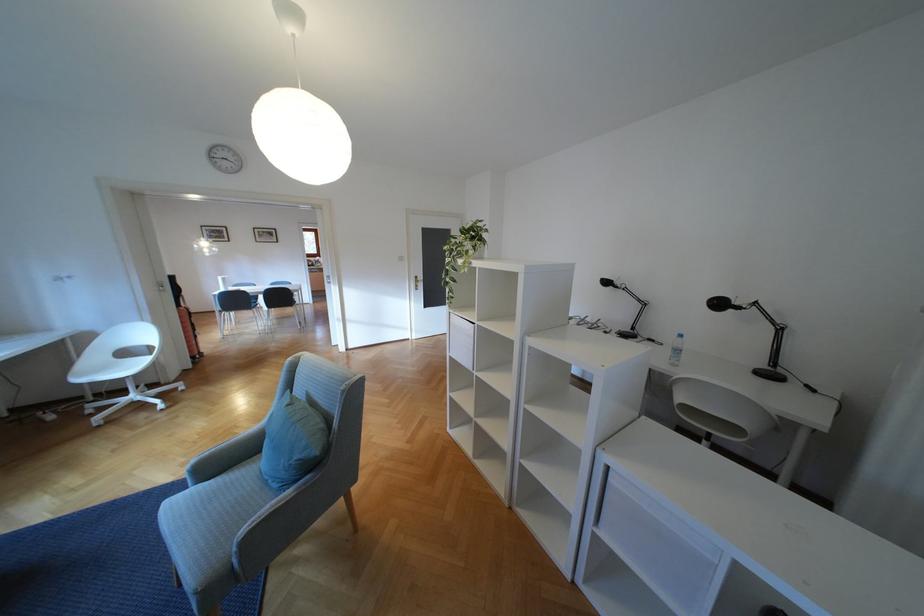
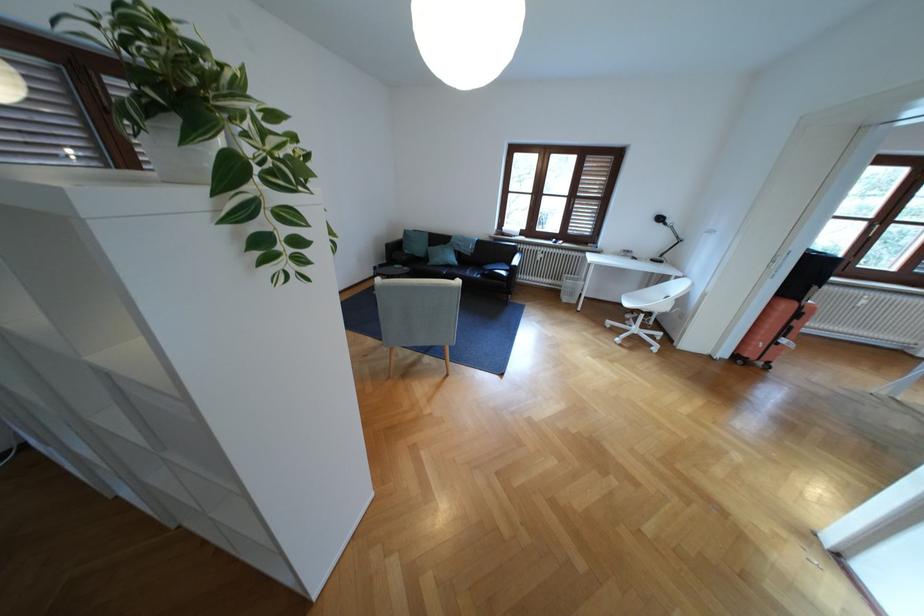
The point at (108, 419) is marked in the first image. Where is the corresponding point in the second image?

(618, 323)